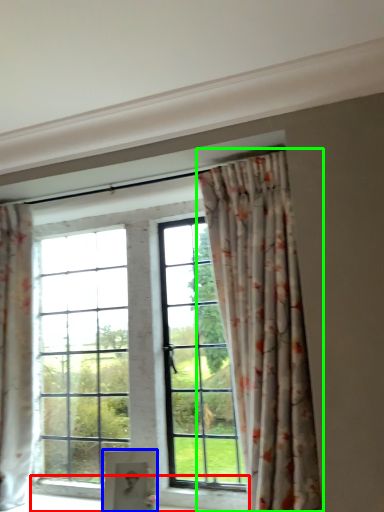
Question: Based on their relative distances, which object is farther from window sill (highlighted by a red box)? Choose from furniture (highlighted by a blue box) and curtain (highlighted by a green box).

Choices:
 (A) furniture
 (B) curtain

Answer: (B)